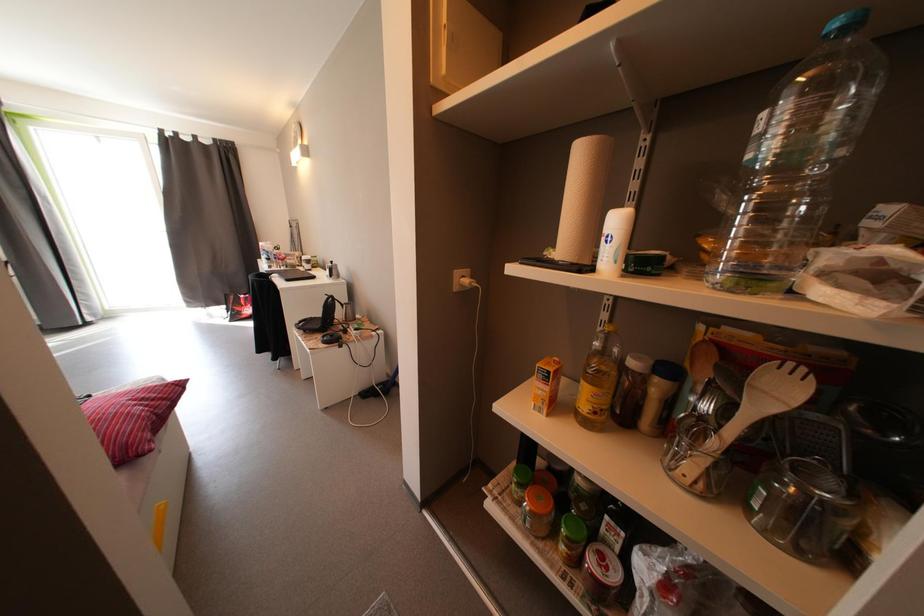
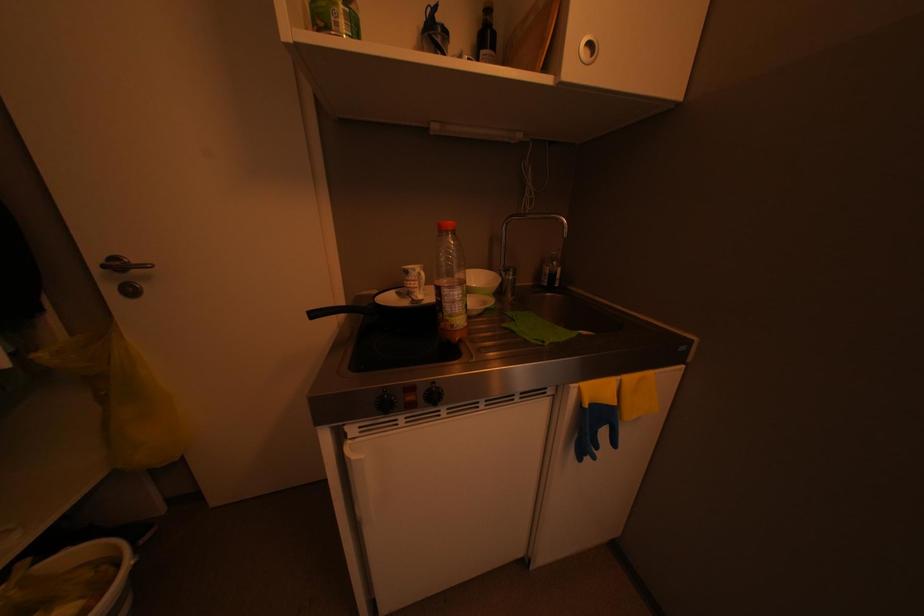
Based on the photo, how did the camera likely rotate?

The camera rotated toward left-down.